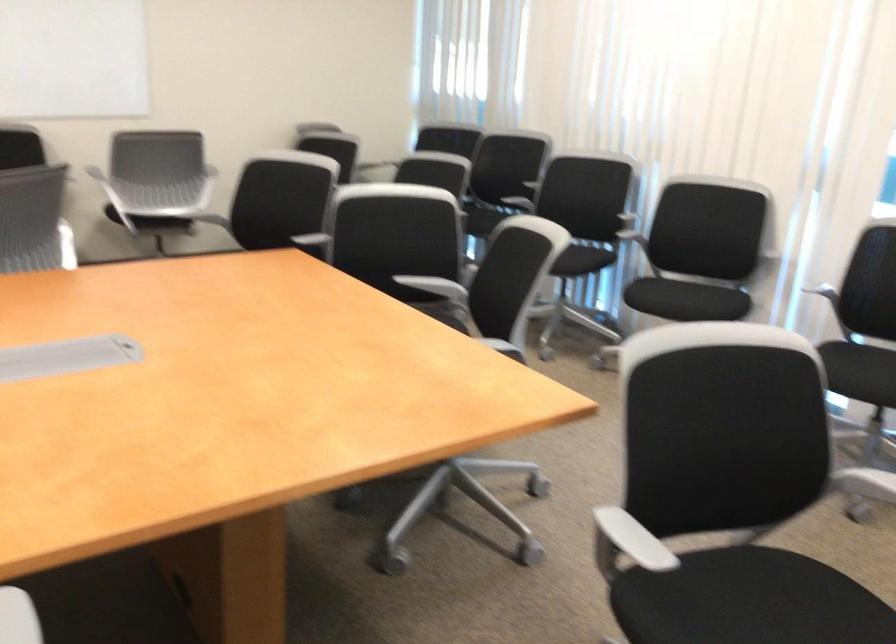
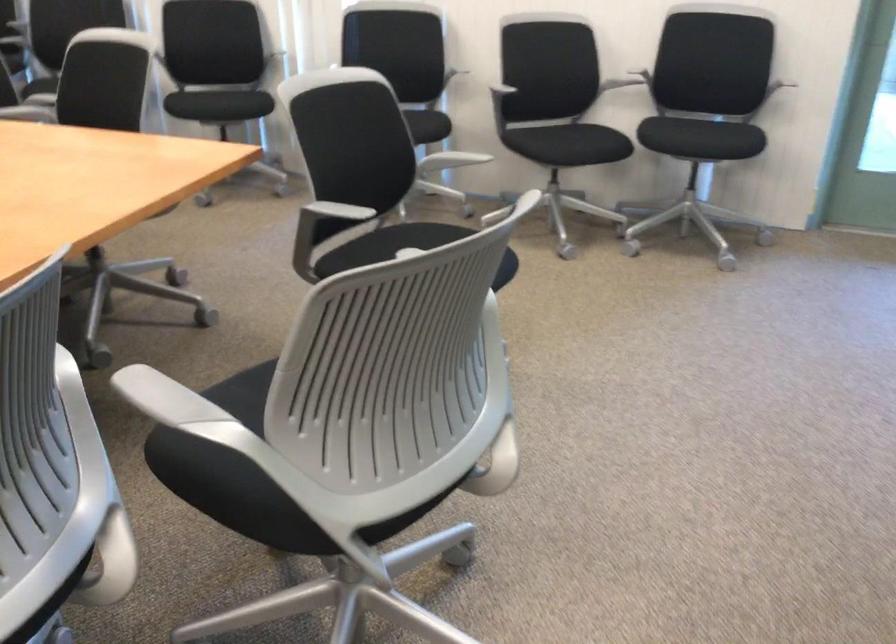
Where in the second image is the point corresponding to point (616, 529) from the first image?

(332, 212)